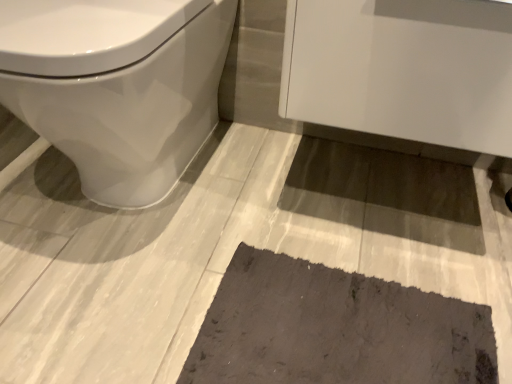
Question: From a real-world perspective, does dark gray textured bath mat at lower center stand above white glossy cabinet at upper right?

Choices:
 (A) yes
 (B) no

Answer: (B)

Question: Would you say dark gray textured bath mat at lower center is a long distance from white glossy cabinet at upper right?

Choices:
 (A) yes
 (B) no

Answer: (B)

Question: Can you confirm if dark gray textured bath mat at lower center is thinner than white glossy cabinet at upper right?

Choices:
 (A) yes
 (B) no

Answer: (A)

Question: Considering the relative sizes of dark gray textured bath mat at lower center and white glossy cabinet at upper right in the image provided, is dark gray textured bath mat at lower center wider than white glossy cabinet at upper right?

Choices:
 (A) no
 (B) yes

Answer: (A)

Question: Does dark gray textured bath mat at lower center have a lesser height compared to white glossy cabinet at upper right?

Choices:
 (A) no
 (B) yes

Answer: (B)

Question: Is point (441, 96) positioned closer to the camera than point (275, 336)?

Choices:
 (A) closer
 (B) farther

Answer: (A)

Question: From a real-world perspective, relative to dark gray textured bath mat at lower center, is white glossy cabinet at upper right vertically above or below?

Choices:
 (A) below
 (B) above

Answer: (B)

Question: Looking at their shapes, would you say white glossy cabinet at upper right is wider or thinner than dark gray textured bath mat at lower center?

Choices:
 (A) wide
 (B) thin

Answer: (A)

Question: From the image's perspective, is white glossy cabinet at upper right above or below dark gray textured bath mat at lower center?

Choices:
 (A) above
 (B) below

Answer: (A)

Question: From the image's perspective, relative to white glossy toilet at left, is dark gray textured bath mat at lower center above or below?

Choices:
 (A) below
 (B) above

Answer: (A)

Question: Is point (444, 345) positioned closer to the camera than point (4, 82)?

Choices:
 (A) closer
 (B) farther

Answer: (B)

Question: From a real-world perspective, relative to white glossy toilet at left, is dark gray textured bath mat at lower center vertically above or below?

Choices:
 (A) below
 (B) above

Answer: (A)

Question: Is dark gray textured bath mat at lower center inside the boundaries of white glossy toilet at left, or outside?

Choices:
 (A) inside
 (B) outside

Answer: (B)

Question: In terms of size, does white glossy toilet at left appear bigger or smaller than dark gray textured bath mat at lower center?

Choices:
 (A) small
 (B) big

Answer: (B)

Question: Is white glossy toilet at left inside the boundaries of dark gray textured bath mat at lower center, or outside?

Choices:
 (A) outside
 (B) inside

Answer: (A)